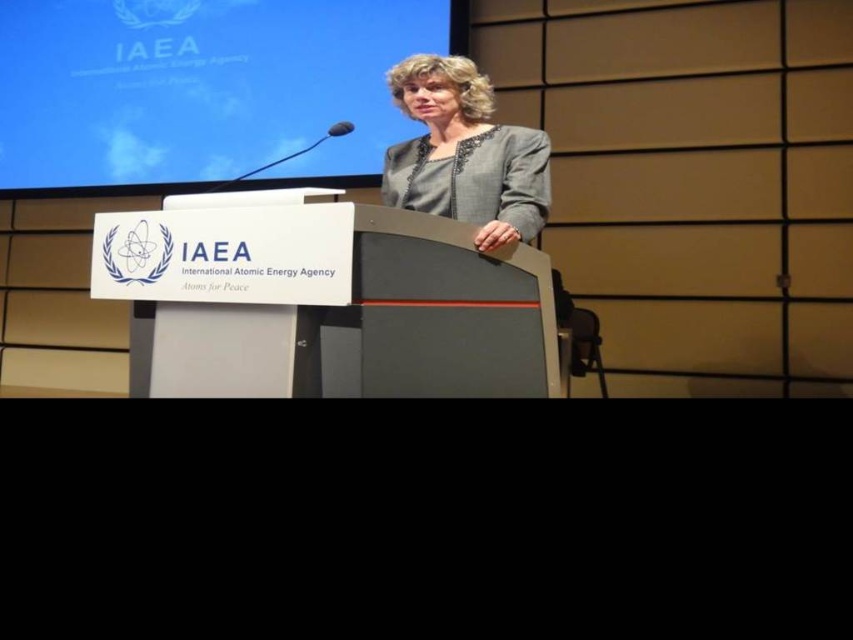
Question: Is blue glossy screen at upper center in front of gray fabric jacket at center?

Choices:
 (A) yes
 (B) no

Answer: (B)

Question: Observing the image, what is the correct spatial positioning of blue glossy screen at upper center in reference to gray fabric jacket at center?

Choices:
 (A) left
 (B) right

Answer: (A)

Question: Which object is the farthest from the gray fabric jacket at center?

Choices:
 (A) blue glossy screen at upper center
 (B) white plastic podium at center

Answer: (A)

Question: Considering the relative positions of white plastic podium at center and gray fabric jacket at center in the image provided, where is white plastic podium at center located with respect to gray fabric jacket at center?

Choices:
 (A) above
 (B) below

Answer: (B)

Question: Which of the following is the closest to the observer?

Choices:
 (A) blue glossy screen at upper center
 (B) white plastic podium at center
 (C) gray fabric jacket at center

Answer: (B)

Question: Which object appears farthest from the camera in this image?

Choices:
 (A) blue glossy screen at upper center
 (B) white plastic podium at center
 (C) gray fabric jacket at center

Answer: (A)